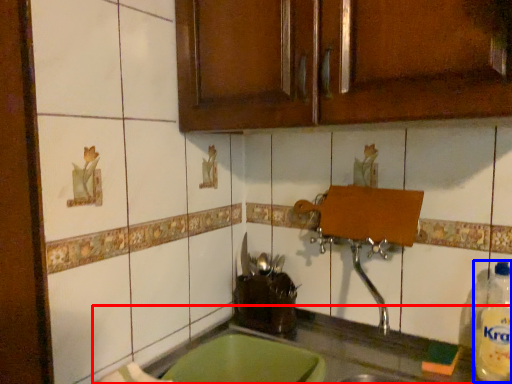
Question: Which point is further to the camera, countertop (highlighted by a red box) or bottle (highlighted by a blue box)?

Choices:
 (A) countertop
 (B) bottle

Answer: (B)